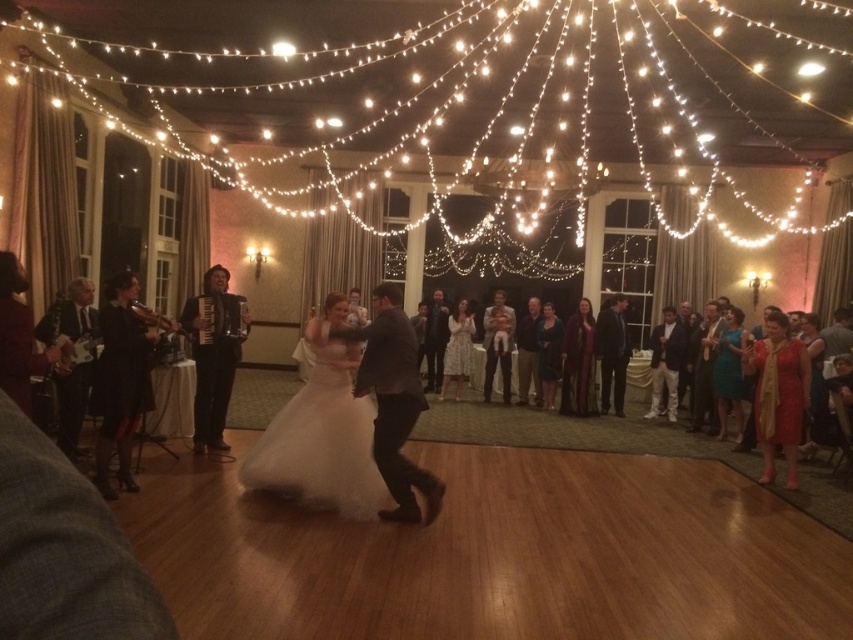
You are a photographer at the wedding reception. You want to capture a photo that includes both the white satin dress at center and the red satin dress at right. Which dress should you position to the left side of your camera frame to include both in the shot?

You should position the white satin dress at center to the left side of your camera frame because it is already to the left of the red satin dress at right in the scene.